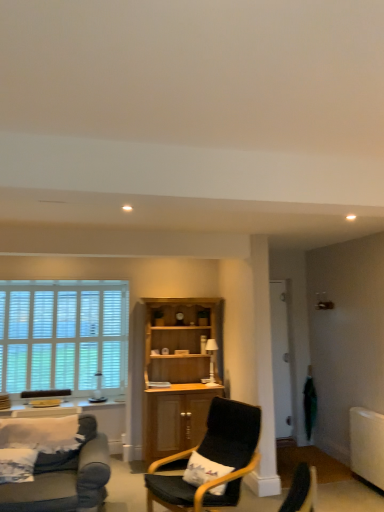
The image size is (384, 512). Find the location of `matte black armchair at lower left`. matte black armchair at lower left is located at coordinates (45, 393).

The height and width of the screenshot is (512, 384). I want to click on transparent glass door at center-right, so click(x=281, y=360).

Measure the distance between white glossy lamp at center and camera.

A distance of 5.04 meters exists between white glossy lamp at center and camera.

What is the approximate width of white glossy lamp at center?

It is 5.89 inches.

You are a GUI agent. You are given a task and a screenshot of the screen. Output one action in this format:
    pyautogui.click(x=<x>, y=<y>)
    Task: Click on the matte black armchair at lower left
    The width and height of the screenshot is (384, 512).
    Given the screenshot: What is the action you would take?
    pyautogui.click(x=45, y=393)

Would you consider matte black armchair at lower left to be distant from white wooden blinds at left?

No, matte black armchair at lower left is in close proximity to white wooden blinds at left.

Is matte black armchair at lower left facing towards white wooden blinds at left?

No, matte black armchair at lower left is not turned towards white wooden blinds at left.

Is matte black armchair at lower left thinner than white wooden blinds at left?

No, matte black armchair at lower left is not thinner than white wooden blinds at left.

Which object is further away from the camera taking this photo, matte black armchair at lower left or white wooden blinds at left?

white wooden blinds at left is more distant.

From a real-world perspective, is white wooden blinds at left positioned under matte black armchair at lower left based on gravity?

No, from a real-world perspective, white wooden blinds at left is not below matte black armchair at lower left.

Is matte black armchair at lower left at the back of white wooden blinds at left?

No.

I want to click on armchair lying below the white wooden blinds at left (from the image's perspective), so click(45, 393).

From the image's perspective, is white wooden blinds at left on matte black armchair at lower left?

Yes, from the image's perspective, white wooden blinds at left is on top of matte black armchair at lower left.

Consider the image. Which is correct: matte black armchair at lower left is inside transparent glass door at center-right, or outside of it?

matte black armchair at lower left is not enclosed by transparent glass door at center-right.

How many degrees apart are the facing directions of matte black armchair at lower left and transparent glass door at center-right?

They differ by 0.267 degrees in their facing directions.

Looking at this image, is matte black armchair at lower left positioned with its back to transparent glass door at center-right?

No, matte black armchair at lower left is not facing the opposite direction of transparent glass door at center-right.

Between matte black armchair at lower left and transparent glass door at center-right, which one has less height?

Standing shorter between the two is matte black armchair at lower left.

Is wooden cabinet at center inside black fabric chair at center?

No, wooden cabinet at center is located outside of black fabric chair at center.

Considering the sizes of objects black fabric chair at center and wooden cabinet at center in the image provided, who is thinner, black fabric chair at center or wooden cabinet at center?

With smaller width is wooden cabinet at center.

Between black fabric chair at center and wooden cabinet at center, which one is positioned in front?

black fabric chair at center is in front.

Consider the image. From the image's perspective, which one is positioned higher, black fabric chair at center or wooden cabinet at center?

From the image's view, wooden cabinet at center is above.

Considering the relative sizes of black fabric chair at center and white glossy lamp at center in the image provided, is black fabric chair at center shorter than white glossy lamp at center?

No.

Would you consider black fabric chair at center to be distant from white glossy lamp at center?

Yes, black fabric chair at center is far from white glossy lamp at center.

Does black fabric chair at center turn towards white glossy lamp at center?

No, black fabric chair at center does not turn towards white glossy lamp at center.

Is point (223, 453) positioned before point (212, 379)?

Yes, point (223, 453) is closer to viewer.

Which object is positioned more to the right, white glossy lamp at center or black fabric chair at center?

Positioned to the right is white glossy lamp at center.

Who is taller, white glossy lamp at center or black fabric chair at center?

black fabric chair at center.

Relative to black fabric chair at center, is white glossy lamp at center in front or behind?

white glossy lamp at center is behind black fabric chair at center.

Image resolution: width=384 pixels, height=512 pixels. In order to click on chair that is below the white glossy lamp at center (from the image's perspective) in this screenshot , I will do `click(212, 459)`.

Is point (117, 331) farther from camera compared to point (169, 482)?

Yes, it is behind point (169, 482).

Consider the image. Are white wooden blinds at left and black fabric chair at center located far from each other?

Yes, white wooden blinds at left and black fabric chair at center are quite far apart.

Is white wooden blinds at left to the right of black fabric chair at center from the viewer's perspective?

Incorrect, white wooden blinds at left is not on the right side of black fabric chair at center.

How different are the orientations of white wooden blinds at left and black fabric chair at center in degrees?

68.1 degrees separate the facing orientations of white wooden blinds at left and black fabric chair at center.

Image resolution: width=384 pixels, height=512 pixels. What are the coordinates of `armchair that is under the white wooden blinds at left (from a real-world perspective)` in the screenshot? It's located at (45, 393).

Locate an element on the screen. The image size is (384, 512). window above the matte black armchair at lower left (from the image's perspective) is located at coordinates (63, 335).

From the image, which object appears to be farther from transparent glass door at center-right, wooden cabinet at center or matte black armchair at lower left?

matte black armchair at lower left lies further to transparent glass door at center-right than the other object.

From the image, which object appears to be nearer to transparent glass door at center-right, white glossy lamp at center or white wooden blinds at left?

white glossy lamp at center.

From the image, which object appears to be farther from wooden cabinet at center, white glossy lamp at center or black fabric chair at center?

black fabric chair at center.

From the image, which object appears to be nearer to black fabric chair at center, transparent glass door at center-right or white glossy lamp at center?

white glossy lamp at center is positioned closer to the anchor black fabric chair at center.

Looking at the image, which one is located further to matte black armchair at lower left, black fabric chair at center or white glossy lamp at center?

The object further to matte black armchair at lower left is black fabric chair at center.

Considering their positions, is wooden cabinet at center positioned closer to matte black armchair at lower left than white wooden blinds at left?

white wooden blinds at left is closer to matte black armchair at lower left.

Which object lies nearer to the anchor point matte black armchair at lower left, white glossy lamp at center or transparent glass door at center-right?

Based on the image, white glossy lamp at center appears to be nearer to matte black armchair at lower left.

Considering their positions, is black fabric chair at center positioned further to white wooden blinds at left than wooden cabinet at center?

black fabric chair at center is further to white wooden blinds at left.

You are a GUI agent. You are given a task and a screenshot of the screen. Output one action in this format:
    pyautogui.click(x=<x>, y=<y>)
    Task: Click on the lamp between white wooden blinds at left and transparent glass door at center-right
    The width and height of the screenshot is (384, 512).
    Given the screenshot: What is the action you would take?
    pyautogui.click(x=211, y=356)

Identify the location of window between matte black armchair at lower left and wooden cabinet at center from left to right. This screenshot has height=512, width=384. (63, 335).

This screenshot has width=384, height=512. In order to click on lamp between black fabric chair at center and transparent glass door at center-right in the front-back direction in this screenshot , I will do `click(211, 356)`.

This screenshot has width=384, height=512. I want to click on chair situated between matte black armchair at lower left and transparent glass door at center-right from left to right, so click(212, 459).